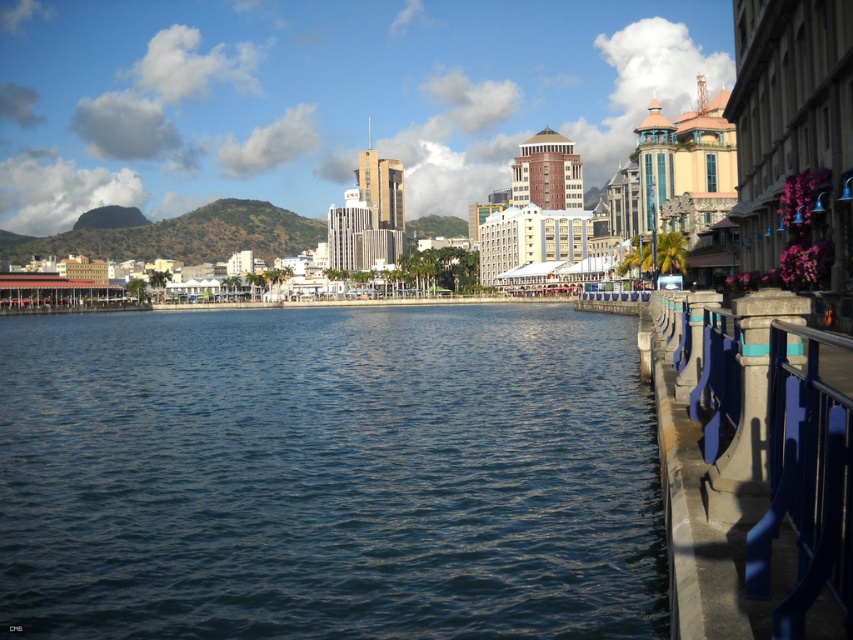
Between blue water at center and blue metallic railing at right, which one has less height?

Standing shorter between the two is blue metallic railing at right.

Who is more forward, (38, 403) or (688, 616)?

Point (688, 616) is more forward.

You are a GUI agent. You are given a task and a screenshot of the screen. Output one action in this format:
    pyautogui.click(x=<x>, y=<y>)
    Task: Click on the blue water at center
    This screenshot has width=853, height=640.
    Given the screenshot: What is the action you would take?
    pyautogui.click(x=328, y=474)